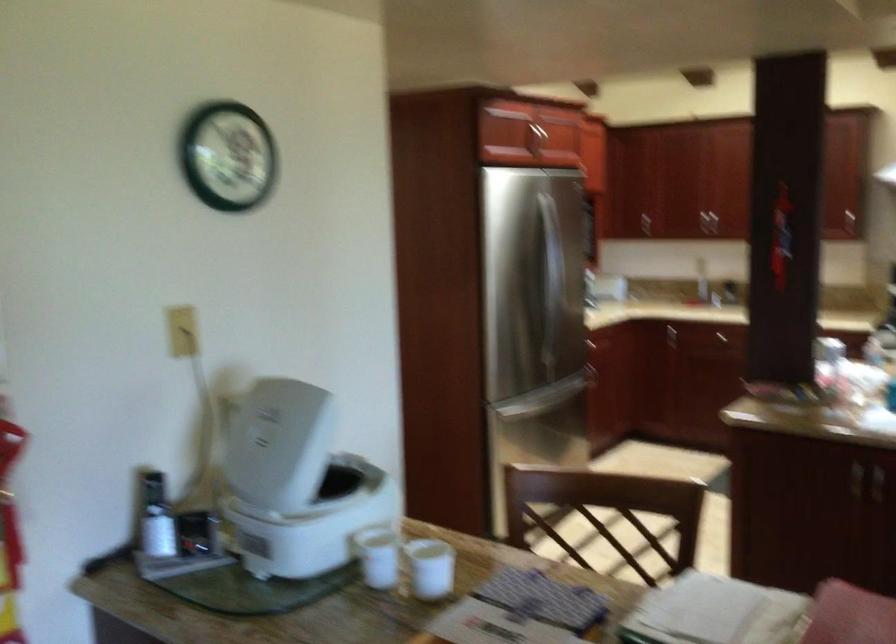
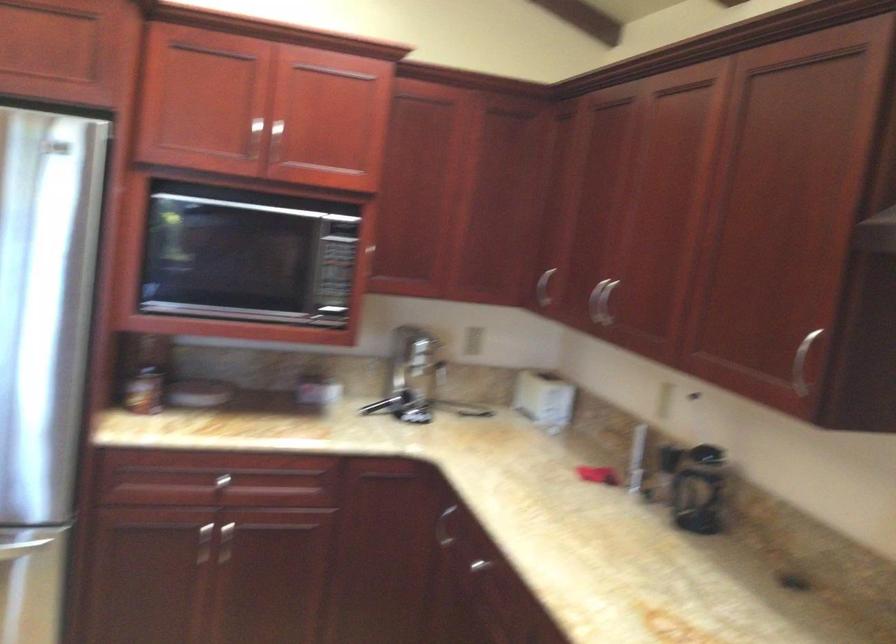
Find the pixel in the second image that matches point 617,205 in the first image.

(544, 287)